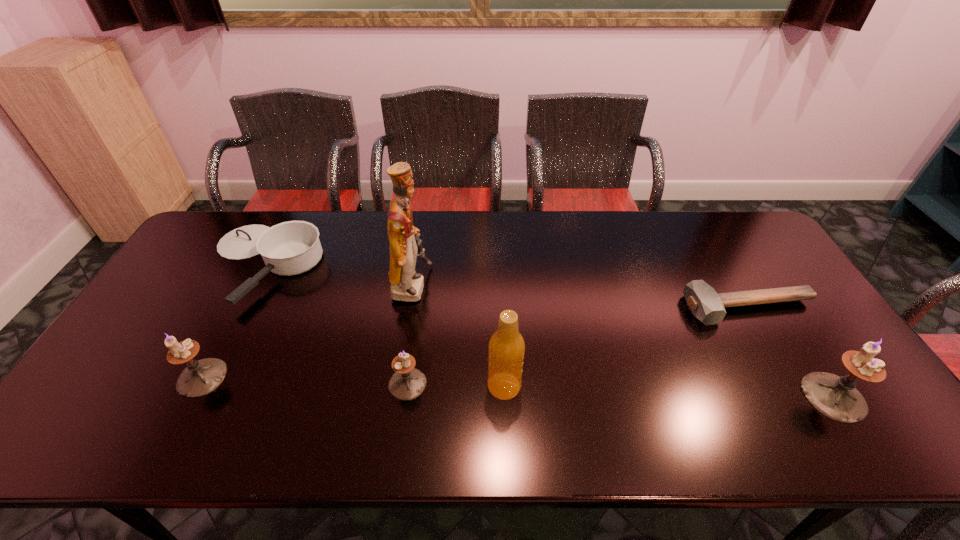
The image size is (960, 540). I want to click on object located at the left edge, so click(x=289, y=248).

Locate an element on the screen. This screenshot has height=540, width=960. candle holder located in the right edge section of the desktop is located at coordinates (835, 397).

Where is `mallet situated at the right edge`? mallet situated at the right edge is located at coordinates (706, 305).

Where is `object positioned at the far left corner`? This screenshot has height=540, width=960. object positioned at the far left corner is located at coordinates tap(289, 248).

Where is `object present at the near right corner`? object present at the near right corner is located at coordinates (835, 397).

This screenshot has height=540, width=960. I want to click on free spot at the far edge of the desktop, so pos(271,215).

Identify the location of free space at the near edge of the desktop. (209, 400).

You are a GUI agent. You are given a task and a screenshot of the screen. Output one action in this format:
    pyautogui.click(x=<x>, y=<y>)
    Task: Click on the blank area at the left edge
    The width and height of the screenshot is (960, 540).
    Given the screenshot: What is the action you would take?
    pyautogui.click(x=132, y=343)

I want to click on free region at the far right corner of the desktop, so click(715, 225).

Image resolution: width=960 pixels, height=540 pixels. In order to click on unoccupied position between the sixth shortest object and the second shortest object in this screenshot , I will do `click(384, 326)`.